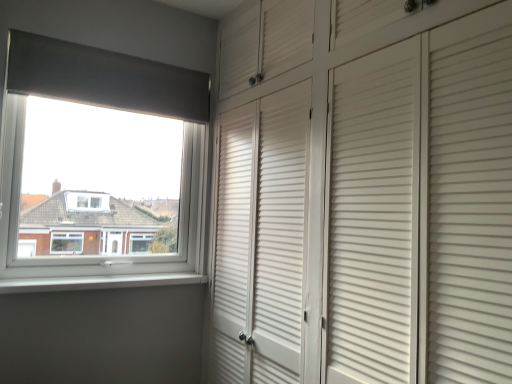
What do you see at coordinates (98, 186) in the screenshot? I see `white plastic window at upper left` at bounding box center [98, 186].

Image resolution: width=512 pixels, height=384 pixels. Identify the location of white plastic window at upper left. (98, 186).

This screenshot has width=512, height=384. Describe the element at coordinates (98, 282) in the screenshot. I see `white smooth window sill at lower left` at that location.

In order to face white smooth window sill at lower left, should I rotate leftwards or rightwards?

To align with it, rotate left about 18.622°.

This screenshot has width=512, height=384. I want to click on white smooth window sill at lower left, so click(x=98, y=282).

You are a GUI agent. You are given a task and a screenshot of the screen. Output one action in this format:
    pyautogui.click(x=<x>, y=<y>)
    Task: Click on the white plastic window at upper left
    Image resolution: width=512 pixels, height=384 pixels.
    Given the screenshot: What is the action you would take?
    pyautogui.click(x=98, y=186)

Between white plastic window at upper left and white smooth window sill at lower left, which one appears on the right side from the viewer's perspective?

From the viewer's perspective, white smooth window sill at lower left appears more on the right side.

Is the position of white plastic window at upper left more distant than that of white smooth window sill at lower left?

That is True.

Which point is more forward, (128, 96) or (203, 282)?

The point (128, 96) is closer to the camera.

From the image's perspective, is white plastic window at upper left positioned above or below white smooth window sill at lower left?

Clearly, from the image's perspective, white plastic window at upper left is above white smooth window sill at lower left.

In the scene shown: From a real-world perspective, relative to white smooth window sill at lower left, is white plastic window at upper left vertically above or below?

From a real-world perspective, white plastic window at upper left is physically above white smooth window sill at lower left.

Can you confirm if white plastic window at upper left is thinner than white smooth window sill at lower left?

No.

Can you confirm if white plastic window at upper left is shorter than white smooth window sill at lower left?

In fact, white plastic window at upper left may be taller than white smooth window sill at lower left.

Considering the sizes of objects white plastic window at upper left and white smooth window sill at lower left in the image provided, who is smaller, white plastic window at upper left or white smooth window sill at lower left?

white smooth window sill at lower left.

Does white plastic window at upper left contain white smooth window sill at lower left?

No, white plastic window at upper left does not contain white smooth window sill at lower left.

From the picture: Is white plastic window at upper left next to white smooth window sill at lower left?

No, white plastic window at upper left is not in contact with white smooth window sill at lower left.

Is white plastic window at upper left turned away from white smooth window sill at lower left?

white plastic window at upper left does not have its back to white smooth window sill at lower left.

From the picture: Can you tell me how much white plastic window at upper left and white smooth window sill at lower left differ in facing direction?

white plastic window at upper left and white smooth window sill at lower left are facing 0.179 degrees away from each other.

Where is `window above the white smooth window sill at lower left (from a real-world perspective)`? This screenshot has width=512, height=384. window above the white smooth window sill at lower left (from a real-world perspective) is located at coordinates (98, 186).

Considering the positions of objects white smooth window sill at lower left and white plastic window at upper left in the image provided, who is more to the right, white smooth window sill at lower left or white plastic window at upper left?

white smooth window sill at lower left.

Considering the positions of objects white smooth window sill at lower left and white plastic window at upper left in the image provided, who is in front, white smooth window sill at lower left or white plastic window at upper left?

white smooth window sill at lower left.

Does point (47, 291) come in front of point (186, 278)?

Yes.

From the image's perspective, between white smooth window sill at lower left and white plastic window at upper left, who is located below?

white smooth window sill at lower left, from the image's perspective.

From a real-world perspective, between white smooth window sill at lower left and white plastic window at upper left, who is vertically lower?

In real-world perspective, white smooth window sill at lower left is lower.

Considering the relative sizes of white smooth window sill at lower left and white plastic window at upper left in the image provided, is white smooth window sill at lower left wider than white plastic window at upper left?

No.

Which of these two, white smooth window sill at lower left or white plastic window at upper left, stands taller?

white plastic window at upper left.

Is white smooth window sill at lower left smaller than white plastic window at upper left?

Correct, white smooth window sill at lower left occupies less space than white plastic window at upper left.

Looking at this image, can we say white smooth window sill at lower left lies outside white plastic window at upper left?

Indeed, white smooth window sill at lower left is completely outside white plastic window at upper left.

Is white smooth window sill at lower left not close to white plastic window at upper left?

No, white smooth window sill at lower left is not far from white plastic window at upper left.

Does white smooth window sill at lower left turn towards white plastic window at upper left?

No, white smooth window sill at lower left does not turn towards white plastic window at upper left.

What's the angular difference between white smooth window sill at lower left and white plastic window at upper left's facing directions?

They differ by 0.179 degrees in their facing directions.

Locate an element on the screen. window sill below the white plastic window at upper left (from the image's perspective) is located at coordinates (98, 282).

You are a GUI agent. You are given a task and a screenshot of the screen. Output one action in this format:
    pyautogui.click(x=<x>, y=<y>)
    Task: Click on the window sill in front of the white plastic window at upper left
    Image resolution: width=512 pixels, height=384 pixels.
    Given the screenshot: What is the action you would take?
    pyautogui.click(x=98, y=282)

The width and height of the screenshot is (512, 384). What are the coordinates of `window that is above the white smooth window sill at lower left (from the image's perspective)` in the screenshot? It's located at [98, 186].